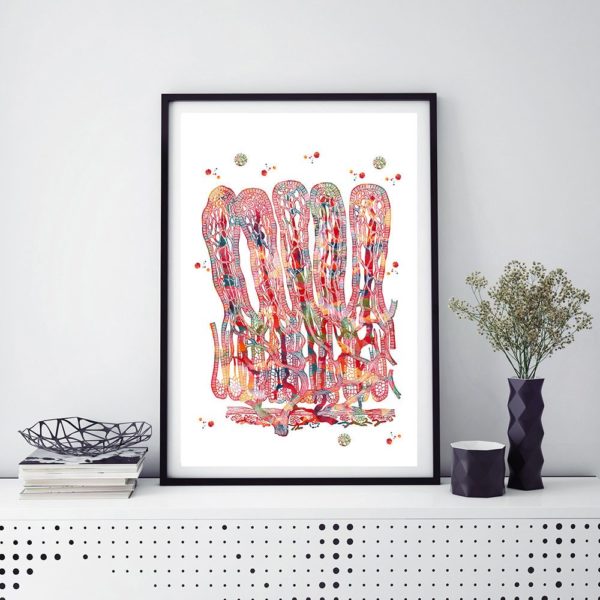
The image size is (600, 600). In order to click on decorative bowl in this screenshot , I will do `click(108, 427)`.